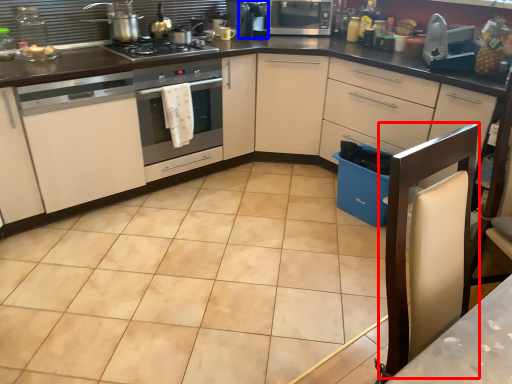
Question: Which object is further to the camera taking this photo, chair (highlighted by a red box) or appliance (highlighted by a blue box)?

Choices:
 (A) chair
 (B) appliance

Answer: (B)